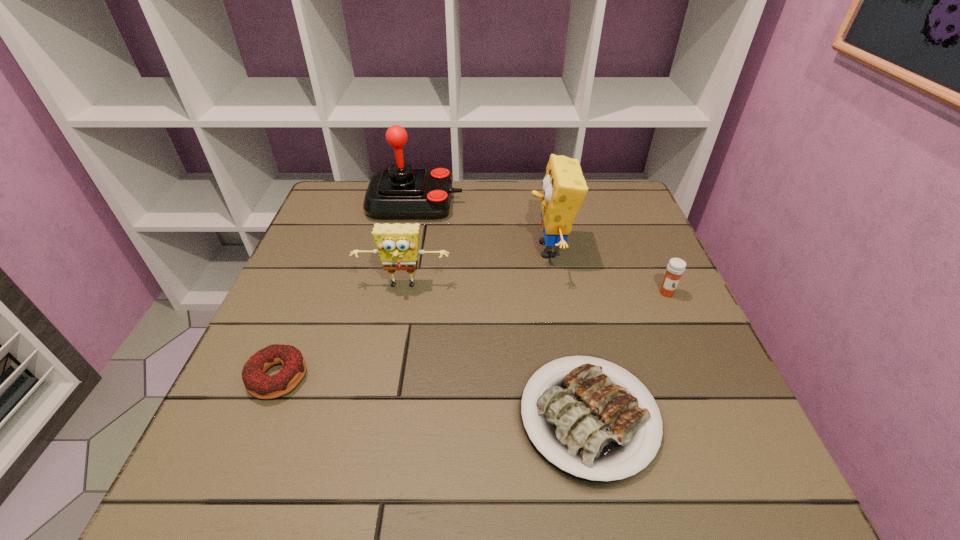
Where is `free spot that satisfies the following two spatial constraints: 1. on the base of the joystick; 2. on the right side of the plate`? This screenshot has width=960, height=540. free spot that satisfies the following two spatial constraints: 1. on the base of the joystick; 2. on the right side of the plate is located at coordinates (x=372, y=416).

At what (x,y) coordinates should I click in order to perform the action: click on vacant region that satisfies the following two spatial constraints: 1. on the base of the shortest object; 2. on the left side of the joystick. Please return your answer as a coordinate pair (x, y). Looking at the image, I should click on (372, 416).

Find the location of `blank space that satisfies the following two spatial constraints: 1. on the face of the taller sponge; 2. on the face of the left sponge`. blank space that satisfies the following two spatial constraints: 1. on the face of the taller sponge; 2. on the face of the left sponge is located at coordinates 556,286.

The height and width of the screenshot is (540, 960). Identify the location of free space in the image that satisfies the following two spatial constraints: 1. on the face of the right sponge; 2. on the face of the third tallest object. (556, 286).

Identify the location of vacant space that satisfies the following two spatial constraints: 1. on the face of the shortest object; 2. on the left side of the shorter sponge. (379, 416).

Where is `free space that satisfies the following two spatial constraints: 1. on the face of the taller sponge; 2. on the face of the third tallest object`? free space that satisfies the following two spatial constraints: 1. on the face of the taller sponge; 2. on the face of the third tallest object is located at coordinates (556, 286).